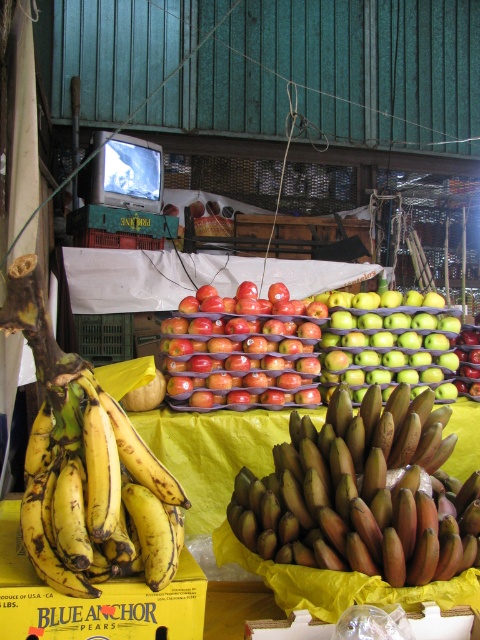
You are a customer at the fruit stall and want to buy bananas. You notice two types of bananas here. The brown rough bananas at center and the yellow matte bananas at lower left. Which type is positioned lower in the display?

The brown rough bananas at center is positioned lower than the yellow matte bananas at lower left.

You are standing at the entrance of the fruit stall and want to locate the brown rough bananas at center. According to the stall layout, where should you look relative to the entrance?

The brown rough bananas at center are located at coordinates point (352,492), which is towards the lower right side of the stall from the entrance.

You are standing at the entrance of the fruit stall and want to locate the brown rough bananas at center. According to the stall layout, where would you find them in terms of their position relative to the entrance?

The brown rough bananas at center are located at the coordinates 0.769 on the x axis and 0.735 on the y axis relative to the entrance, which places them towards the right and slightly forward from the entrance.